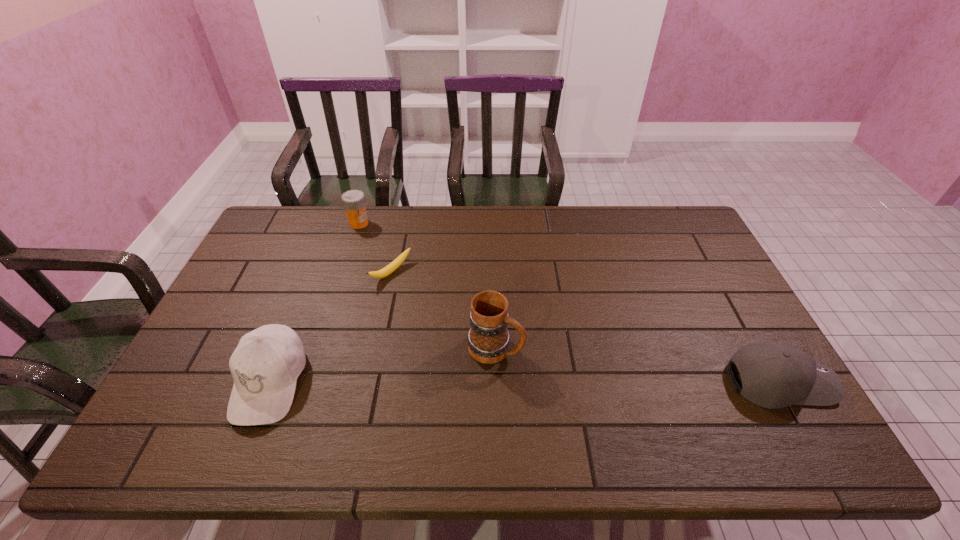
You are a GUI agent. You are given a task and a screenshot of the screen. Output one action in this format:
    pyautogui.click(x=<x>, y=<y>)
    Task: Click on the left baseball cap
    The height and width of the screenshot is (540, 960).
    Given the screenshot: What is the action you would take?
    pyautogui.click(x=265, y=366)

Find the location of a particular element. The width and height of the screenshot is (960, 540). the rightmost object is located at coordinates (774, 375).

The image size is (960, 540). In order to click on the third object from left to right in this screenshot , I will do `click(394, 265)`.

This screenshot has height=540, width=960. What are the coordinates of `the shortest object` in the screenshot? It's located at (394, 265).

The width and height of the screenshot is (960, 540). In order to click on medicine in this screenshot , I will do `click(353, 201)`.

Where is `mug`? mug is located at coordinates click(x=488, y=339).

The width and height of the screenshot is (960, 540). Identify the location of the tallest object. (488, 339).

This screenshot has height=540, width=960. In order to click on free space located 0.100m on the upward curve of the banana in this screenshot , I will do `click(426, 297)`.

Locate an element on the screen. free space located on the upward curve of the banana is located at coordinates coord(426,297).

This screenshot has height=540, width=960. I want to click on vacant space located on the upward curve of the banana, so (445, 310).